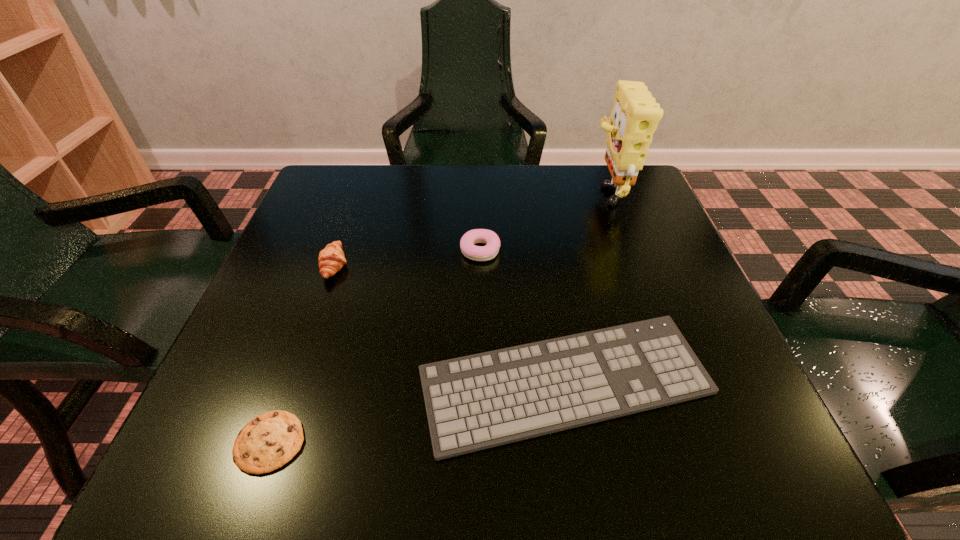
Locate an element on the screen. The height and width of the screenshot is (540, 960). sponge located in the right edge section of the desktop is located at coordinates (635, 115).

Where is `computer keyboard that is at the right edge`? Image resolution: width=960 pixels, height=540 pixels. computer keyboard that is at the right edge is located at coordinates (480, 401).

Find the location of `object at the near left corner`. object at the near left corner is located at coordinates (267, 442).

At what (x,y) coordinates should I click in order to perform the action: click on object that is at the far right corner. Please return your answer as a coordinate pair (x, y). This screenshot has width=960, height=540. Looking at the image, I should click on (635, 115).

This screenshot has height=540, width=960. In order to click on object present at the near right corner in this screenshot , I will do `click(480, 401)`.

Where is `free region at the far edge`? free region at the far edge is located at coordinates (469, 179).

This screenshot has height=540, width=960. I want to click on free spot at the near edge of the desktop, so click(572, 431).

Identify the location of free region at the left edge of the desktop. (318, 243).

You are a GUI agent. You are given a task and a screenshot of the screen. Output one action in this format:
    pyautogui.click(x=<x>, y=<y>)
    Task: Click on the free region at the right edge of the desktop
    The width and height of the screenshot is (960, 540).
    Given the screenshot: What is the action you would take?
    pyautogui.click(x=708, y=318)

Locate an element on the screen. The width and height of the screenshot is (960, 540). free point at the far left corner is located at coordinates (372, 190).